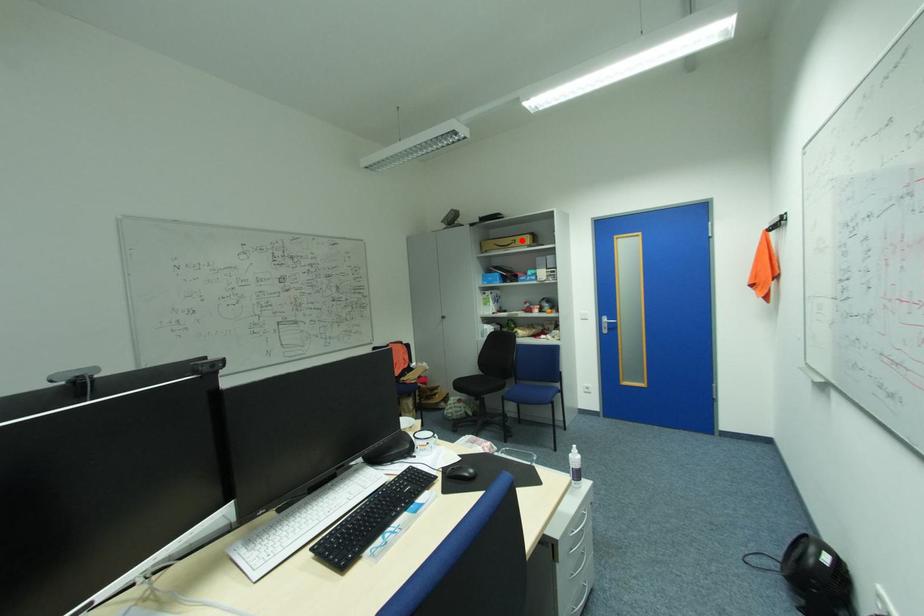
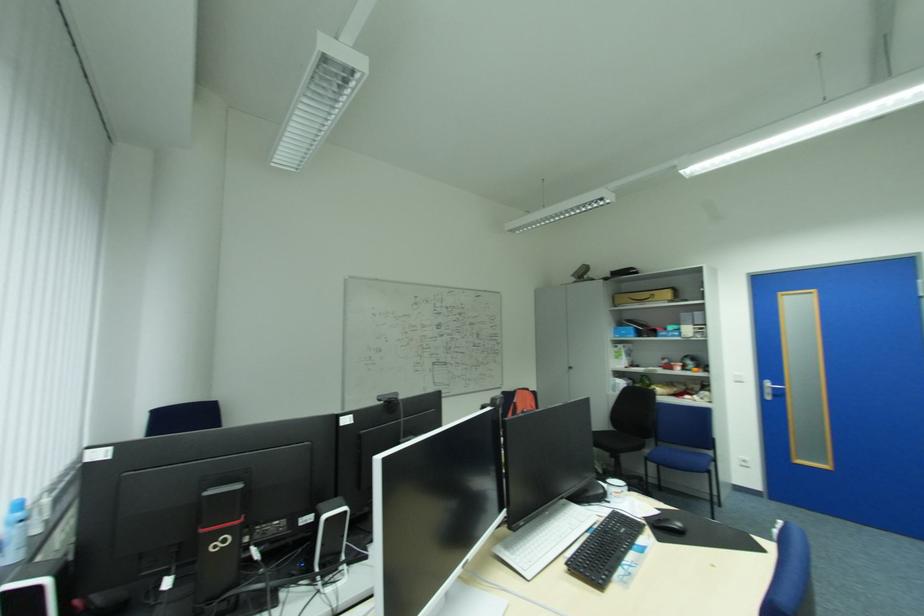
Where in the second image is the point corresponding to the highlighted location from the first image?

(659, 294)